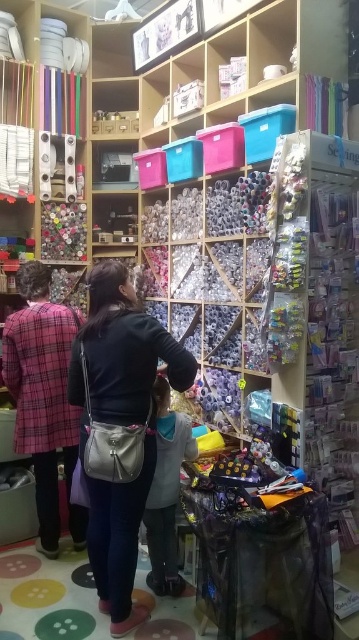
You are a customer in the store and want to place both the matte black purse at center and the plaid fabric coat at left on a shelf. The shelf has a width of 1 meter. Can both items fit side by side?

The matte black purse at center is wider than the plaid fabric coat at left. Since the shelf is 1 meter wide, it depends on their combined widths. However, the description only states the purse is wider, not the exact dimensions. Without specific measurements, we cannot confirm if they fit together.

You are a customer in the store and want to place the matte black purse at center on top of the plaid fabric coat at left. Will the coat be able to fully support the purse?

The matte black purse at center is larger in size than the plaid fabric coat at left, so the coat may not be able to fully support the purse due to its smaller size.

You are standing in the craft store and see the matte black purse at center and the plaid fabric coat at left. Which one is positioned to the right of the other?

The matte black purse at center is positioned to the right of the plaid fabric coat at left.